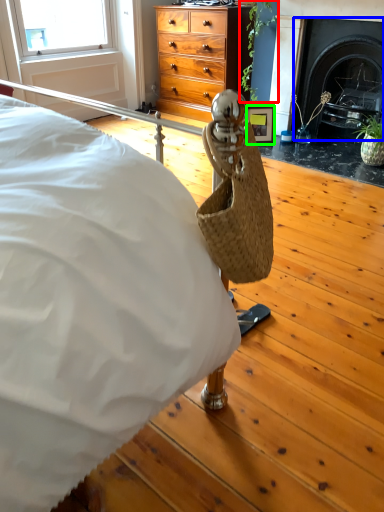
Question: Which object is the farthest from plant (highlighted by a red box)? Choose among these: fireplace (highlighted by a blue box) or picture frame (highlighted by a green box).

Choices:
 (A) fireplace
 (B) picture frame

Answer: (A)